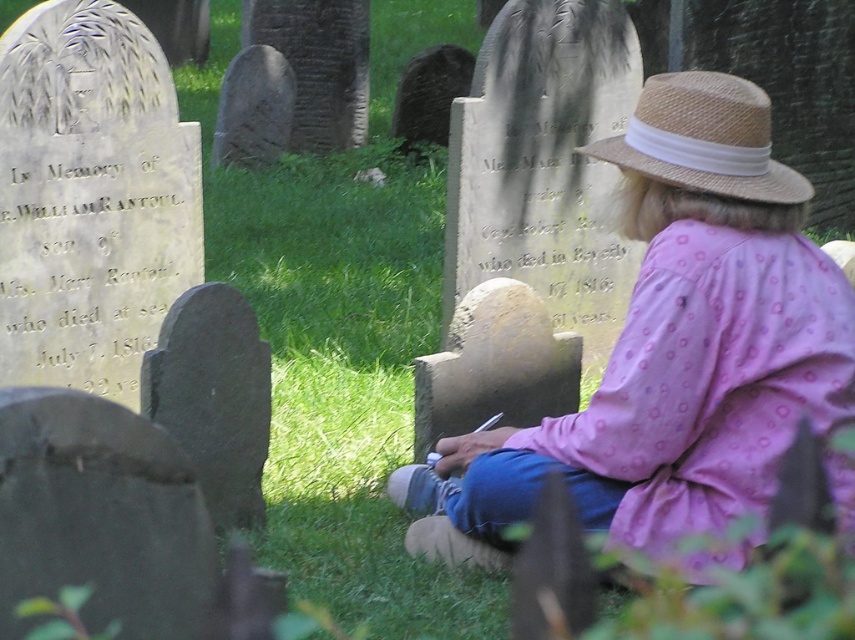
Looking at this image, does pink dotted shirt at center have a smaller size compared to straw hat at upper right?

Incorrect, pink dotted shirt at center is not smaller in size than straw hat at upper right.

Is point (709, 234) behind point (693, 140)?

That is False.

The height and width of the screenshot is (640, 855). Find the location of `pink dotted shirt at center`. pink dotted shirt at center is located at coordinates (677, 346).